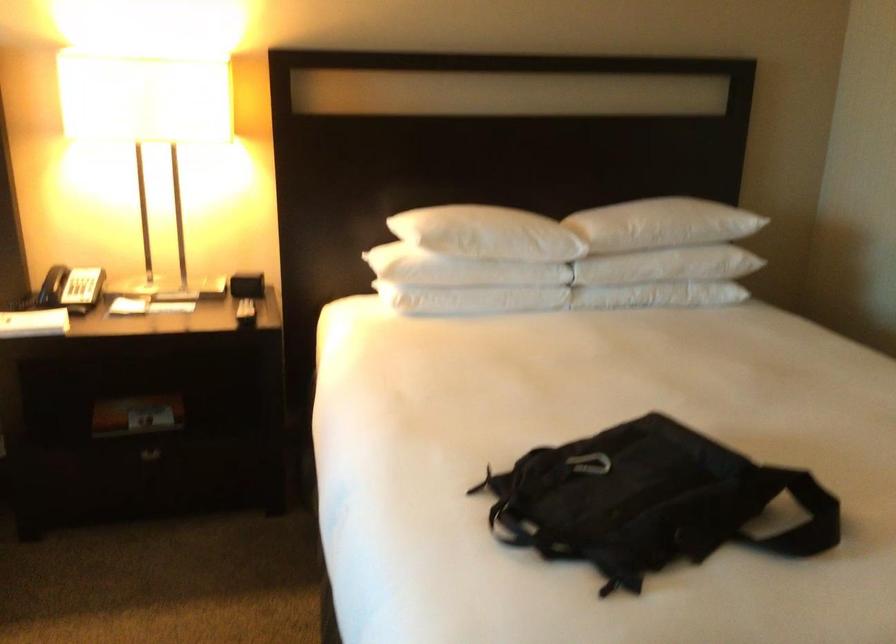
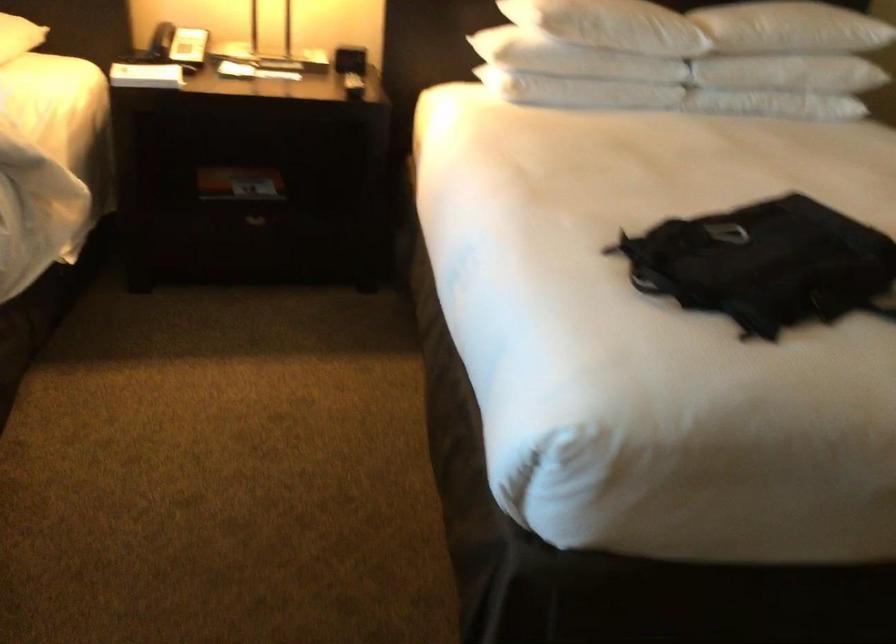
From the picture: In a continuous first-person perspective shot, in which direction is the camera moving?

The cameraman walked toward left, backward.